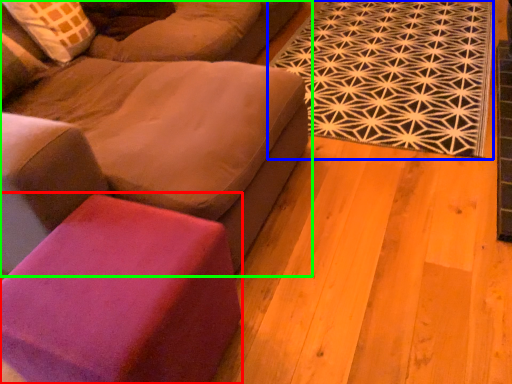
Question: Based on their relative distances, which object is nearer to stool (highlighted by a red box)? Choose from mat (highlighted by a blue box) and studio couch (highlighted by a green box).

Choices:
 (A) mat
 (B) studio couch

Answer: (B)